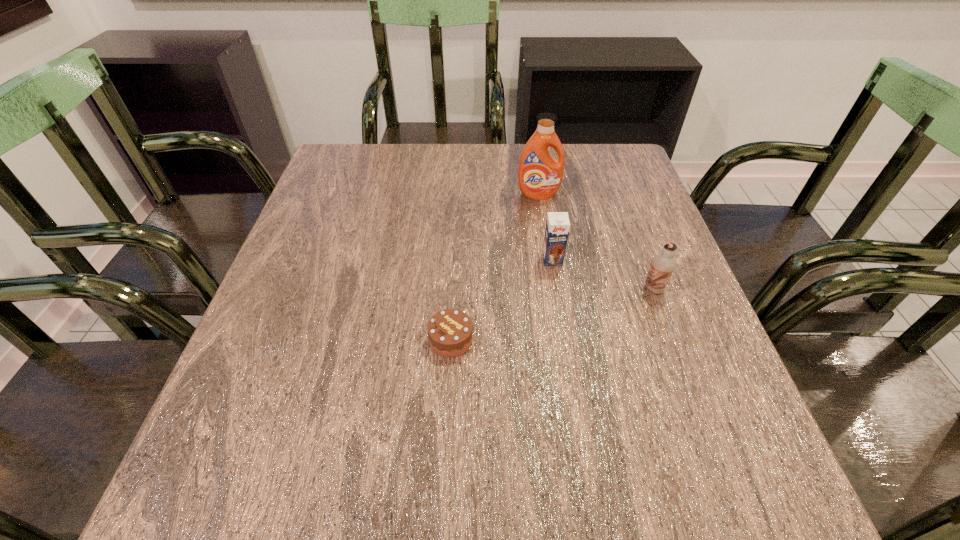
Identify the location of the tallest object. (539, 175).

This screenshot has height=540, width=960. I want to click on detergent, so click(539, 175).

Where is `the farther chocolate milk`? The image size is (960, 540). the farther chocolate milk is located at coordinates (557, 225).

Find the location of `the left chocolate milk`. the left chocolate milk is located at coordinates (557, 225).

Find the location of a particular element. the third farthest object is located at coordinates (662, 266).

The width and height of the screenshot is (960, 540). I want to click on the right chocolate milk, so click(662, 266).

You are a GUI agent. You are given a task and a screenshot of the screen. Output one action in this format:
    pyautogui.click(x=<x>, y=<y>)
    Task: Click on the leftmost object
    Image resolution: width=960 pixels, height=540 pixels.
    Given the screenshot: What is the action you would take?
    pyautogui.click(x=450, y=332)

Locate an element on the screen. This screenshot has width=960, height=540. the shortest object is located at coordinates pos(450,332).

At what (x,y) coordinates should I click in order to perform the action: click on vacant space located on the front-facing side of the detergent. Please return your answer as a coordinate pair (x, y). The width and height of the screenshot is (960, 540). Looking at the image, I should click on (545, 241).

The width and height of the screenshot is (960, 540). In order to click on free spot located 0.190m on the front label of the left chocolate milk in this screenshot , I will do `click(565, 338)`.